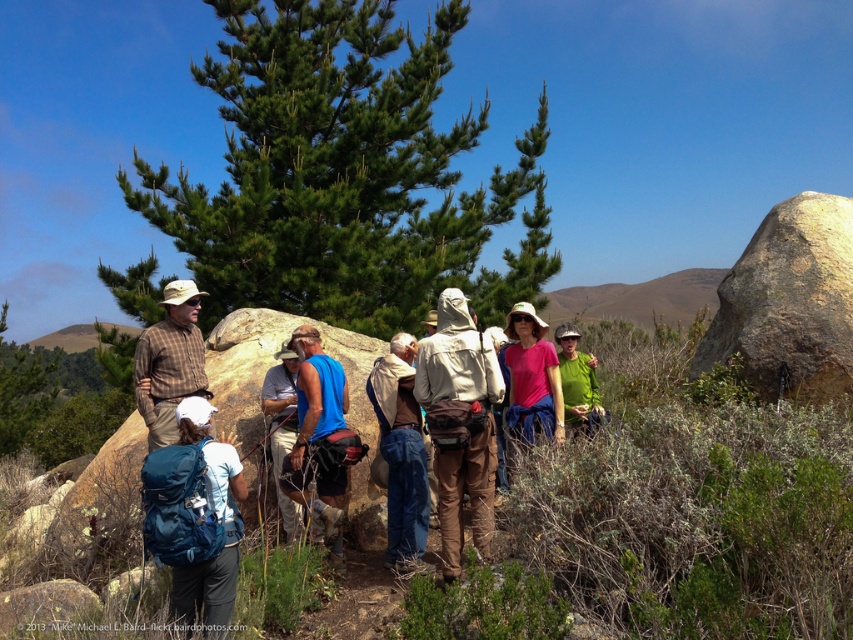
You are a hiker who wants to take a photo of the green needle pine tree at the center of the image. You are standing at the point marked by the coordinate point (343,173). Can you confirm if you are already at the correct location to take the photo?

The green needle pine tree at center is represented by the point (343,173), so yes, you are already at the correct location to take the photo.

Based on the scene description, what object is located at the coordinates point [343,173]?

The point [343,173] corresponds to the green needle like pine at center.

You are a photographer positioned at the center of the image. You want to take a photo that includes both the blue fabric backpack at lower left and the tall pine tree in the background. Based on their positions, will the backpack be to the left or right of the pine tree in the final photo?

The blue fabric backpack at lower left is located at point 0.814 on the x axis, which is closer to the right edge of the image. Since the pine tree is in the background and centered behind the group, the backpack will appear to the right of the pine tree in the photo.